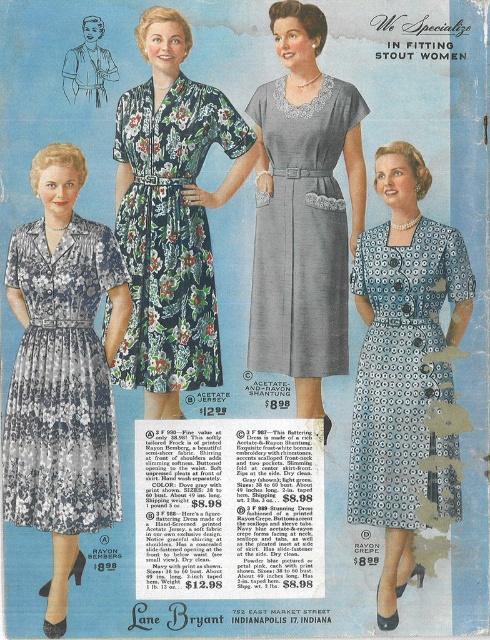
Based on the scene description, which dress is positioned lower between the blue printed fabric dress at center and the gray acetate dress at center?

The blue printed fabric dress at center is located below the gray acetate dress at center, so it is positioned lower.

From the picture: You are standing in front of the Lane Bryant advertisement and want to touch both the point at coordinates point (174, 388) and point (396, 524). Which point will you reach first?

You will reach point (174, 388) first because it is closer to you than point (396, 524), which is further away.